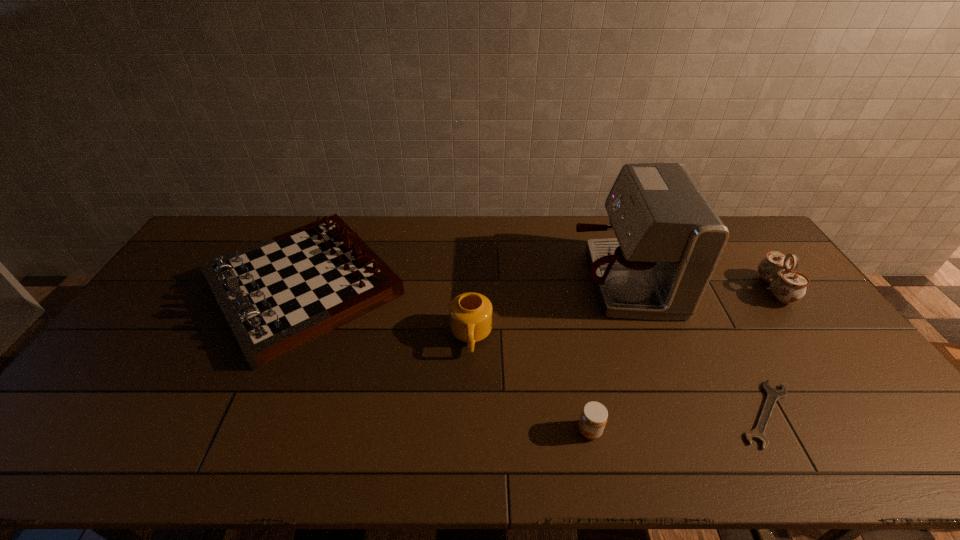
The height and width of the screenshot is (540, 960). I want to click on gameboard present at the far edge, so click(x=279, y=294).

Find the location of a particular element. The height and width of the screenshot is (540, 960). jam that is at the near edge is located at coordinates (594, 415).

At what (x,y) coordinates should I click in order to perform the action: click on wrench that is at the near edge. Please return your answer as a coordinate pair (x, y). Looking at the image, I should click on (773, 395).

The height and width of the screenshot is (540, 960). Identify the location of object located at the left edge. (279, 294).

Identify the location of object at the right edge. (788, 286).

Locate an element on the screen. The width and height of the screenshot is (960, 540). object at the far left corner is located at coordinates (279, 294).

The width and height of the screenshot is (960, 540). Find the location of `vacant space at the far edge of the desktop`. vacant space at the far edge of the desktop is located at coordinates (530, 233).

The image size is (960, 540). I want to click on blank space at the near edge, so click(x=155, y=456).

In the image, there is a desktop. At what (x,y) coordinates should I click in order to perform the action: click on vacant space at the left edge. Please return your answer as a coordinate pair (x, y). The height and width of the screenshot is (540, 960). Looking at the image, I should click on (187, 312).

You are a GUI agent. You are given a task and a screenshot of the screen. Output one action in this format:
    pyautogui.click(x=<x>, y=<y>)
    Task: Click on the free spot at the right edge of the desktop
    Image resolution: width=960 pixels, height=540 pixels.
    Given the screenshot: What is the action you would take?
    pyautogui.click(x=853, y=391)